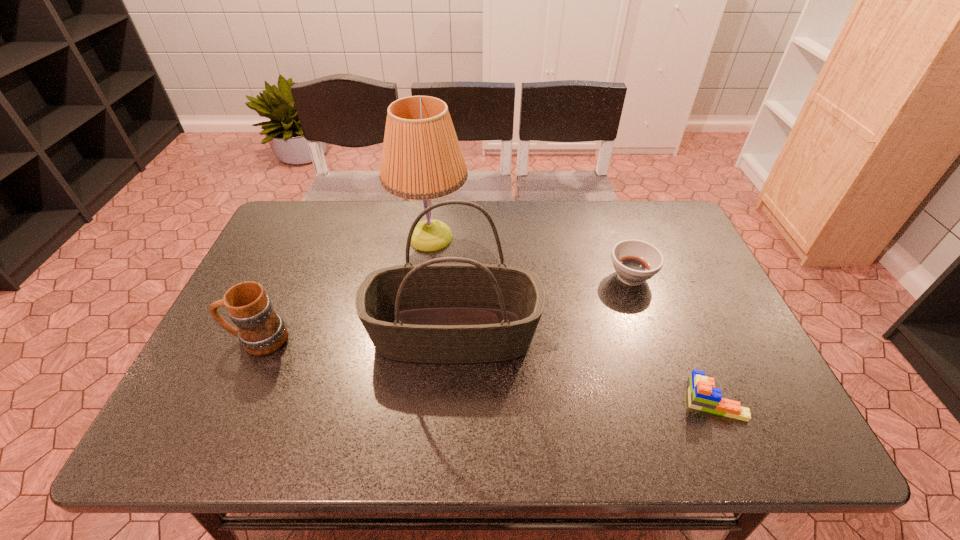
In the image, there is a desktop. Identify the location of free space at the far right corner. This screenshot has height=540, width=960. (684, 240).

At what (x,y) coordinates should I click in order to perform the action: click on vacant point located between the tallest object and the Lego. Please return your answer as a coordinate pair (x, y). This screenshot has width=960, height=540. Looking at the image, I should click on (572, 319).

The height and width of the screenshot is (540, 960). I want to click on free space between the fourth shortest object and the nearest object, so click(584, 367).

You are a GUI agent. You are given a task and a screenshot of the screen. Output one action in this format:
    pyautogui.click(x=<x>, y=<y>)
    Task: Click on the vacant region between the mug and the fourth shortest object
    
    Given the screenshot: What is the action you would take?
    pyautogui.click(x=355, y=336)

You are a GUI agent. You are given a task and a screenshot of the screen. Output one action in this format:
    pyautogui.click(x=<x>, y=<y>)
    Task: Click on the vacant space that is in between the soup bowl and the lamp
    The height and width of the screenshot is (540, 960).
    Given the screenshot: What is the action you would take?
    pyautogui.click(x=531, y=257)

The width and height of the screenshot is (960, 540). Find the location of `free space between the lamp and the nearest object`. free space between the lamp and the nearest object is located at coordinates (572, 319).

At what (x,y) coordinates should I click in order to perform the action: click on empty space between the tallest object and the nearest object. Please return your answer as a coordinate pair (x, y). Looking at the image, I should click on (572, 319).

This screenshot has height=540, width=960. Identify the location of free space between the soup bowl and the Lego. (672, 339).

The height and width of the screenshot is (540, 960). Identify the location of object that is the fourth closest to the nearest object. (261, 331).

At what (x,y) coordinates should I click in order to perform the action: click on object that stands as the fourth closest to the mug. Please return your answer as a coordinate pair (x, y). Looking at the image, I should click on tap(702, 395).